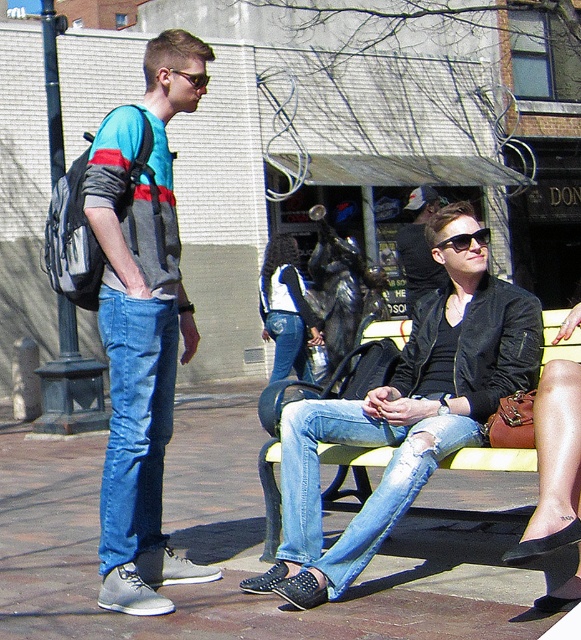
Is matte blue jeans at left to the right of denim jacket at center from the viewer's perspective?

Incorrect, matte blue jeans at left is not on the right side of denim jacket at center.

How distant is matte blue jeans at left from denim jacket at center?

matte blue jeans at left and denim jacket at center are 22.19 feet apart from each other.

Is point (152, 333) positioned before point (306, 326)?

Yes, it is in front of point (306, 326).

Locate an element on the screen. matte blue jeans at left is located at coordinates point(142,326).

Between ripped denim jeans at center and denim jacket at center, which one has less height?

ripped denim jeans at center is shorter.

Does ripped denim jeans at center have a greater width compared to denim jacket at center?

Yes.

Measure the distance between ripped denim jeans at center and camera.

ripped denim jeans at center is 4.82 meters from camera.

You are a GUI agent. You are given a task and a screenshot of the screen. Output one action in this format:
    pyautogui.click(x=<x>, y=<y>)
    Task: Click on the ripped denim jeans at center
    
    Given the screenshot: What is the action you would take?
    pyautogui.click(x=374, y=490)

Is yellow wood bench at center in front of denim jeans at center?

Yes, it is.

Who is lower down, yellow wood bench at center or denim jeans at center?

yellow wood bench at center

Which is in front, point (543, 340) or point (286, 337)?

Point (543, 340) is in front.

Where is `yellow wood bench at center`? Image resolution: width=581 pixels, height=640 pixels. yellow wood bench at center is located at coordinates (352, 470).